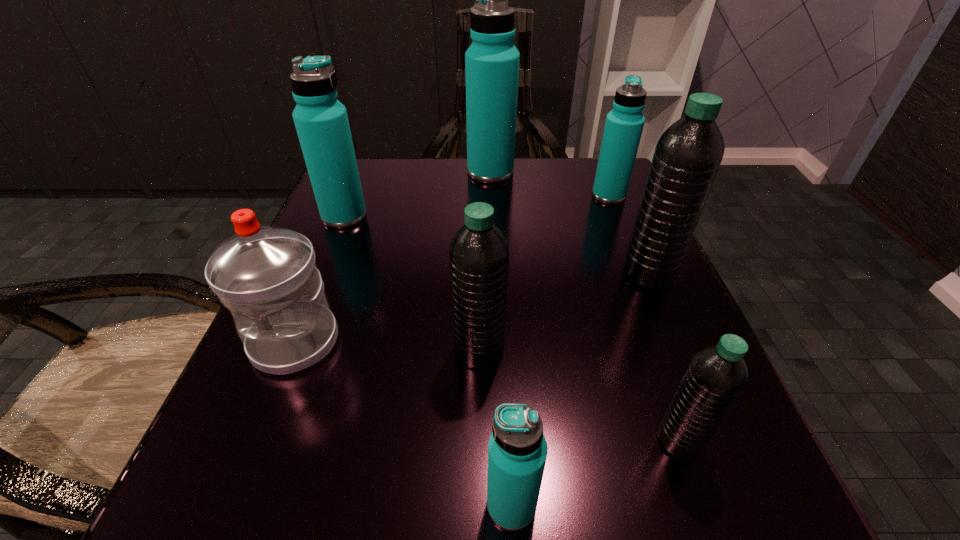
The height and width of the screenshot is (540, 960). Identify the location of the second nearest water bottle. (716, 376).

Locate an element on the screen. The image size is (960, 540). the nearest water bottle is located at coordinates (517, 450).

Find the location of a particular element. The height and width of the screenshot is (540, 960). the nearest object is located at coordinates (517, 450).

Identify the location of vacant space located on the right of the farthest object. The width and height of the screenshot is (960, 540). (587, 172).

Where is `free spot located 0.060m on the back of the leftmost blue water bottle`? Image resolution: width=960 pixels, height=540 pixels. free spot located 0.060m on the back of the leftmost blue water bottle is located at coordinates (355, 189).

This screenshot has width=960, height=540. Identify the location of free space located on the front of the fifth nearest object. [x=672, y=328].

You are a GUI agent. You are given a task and a screenshot of the screen. Output one action in this format:
    pyautogui.click(x=<x>, y=<y>)
    Task: Click on the free space located on the left of the rightmost blue water bottle
    The width and height of the screenshot is (960, 540).
    Given the screenshot: What is the action you would take?
    pyautogui.click(x=485, y=195)

Identify the location of free space located on the left of the leftmost black water bottle. (358, 350).

Find the location of `free region located on the handle side of the white water bottle`. free region located on the handle side of the white water bottle is located at coordinates (x=228, y=511).

Where is `vacant space located 0.240m on the left of the second nearest water bottle`? The height and width of the screenshot is (540, 960). vacant space located 0.240m on the left of the second nearest water bottle is located at coordinates (459, 440).